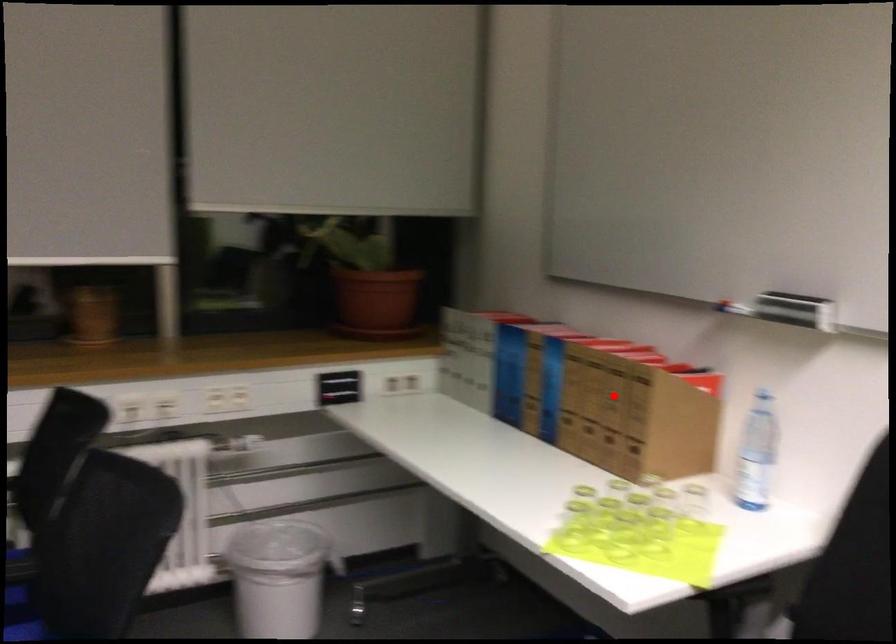
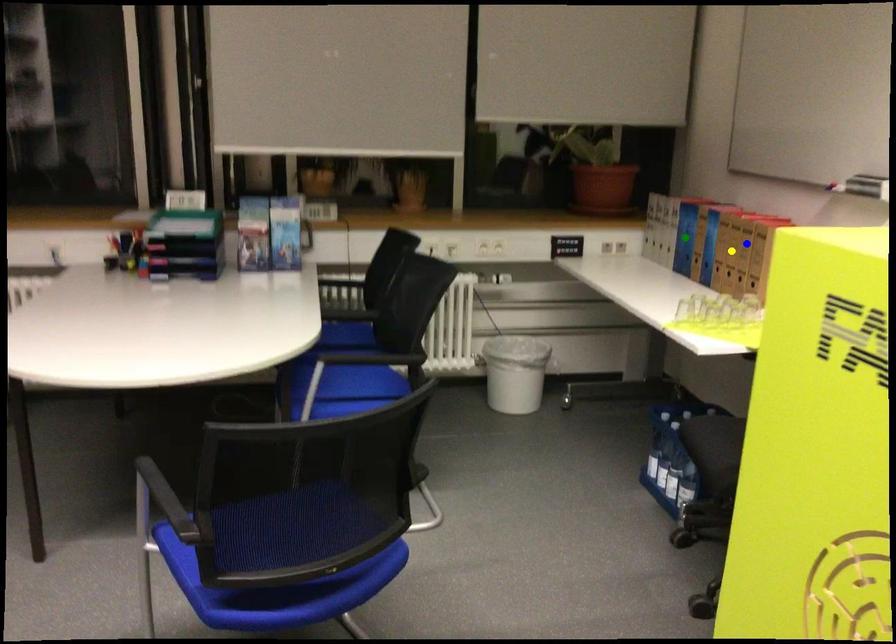
Question: I am providing you with two images of the same scene from different viewpoints. A red point is marked on the first image. You are given multiple points on the second image. Can you choose the point in image 2 that corresponds to the point in image 1?

Choices:
 (A) yellow point
 (B) green point
 (C) blue point

Answer: (C)